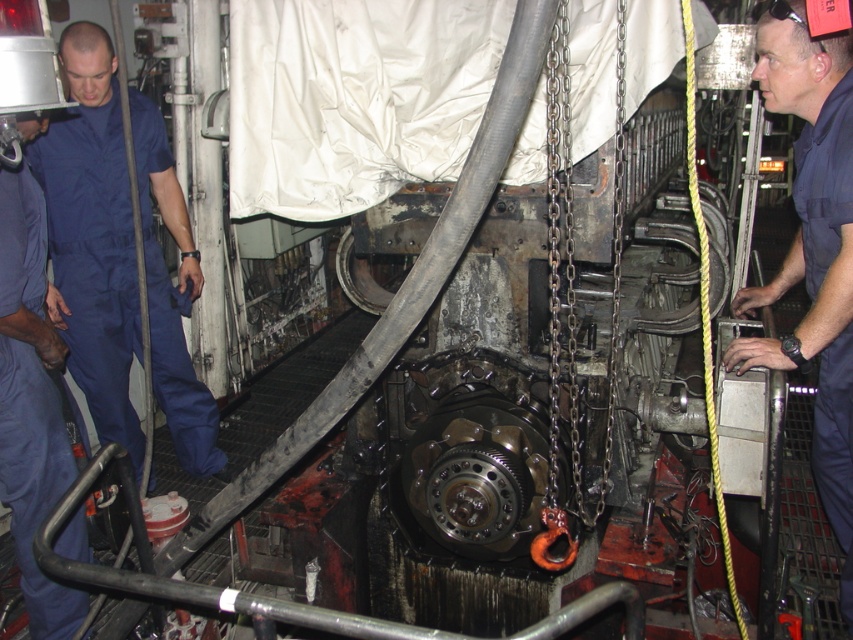
You are an engineer in this workshop and need to access the machinery covered by the white tarpaulin. There is a blue cotton jumpsuit at left. Where exactly is the blue cotton jumpsuit located in relation to the machinery?

The blue cotton jumpsuit at left is located at point (91,236) relative to the machinery.

You are an inspector in the workshop and need to check the machinery. Which uniform is closer to the machinery between the blue cotton jumpsuit at left and the dark blue uniform at center?

The dark blue uniform at center is behind the blue cotton jumpsuit at left, so the blue cotton jumpsuit at left is closer to the machinery.